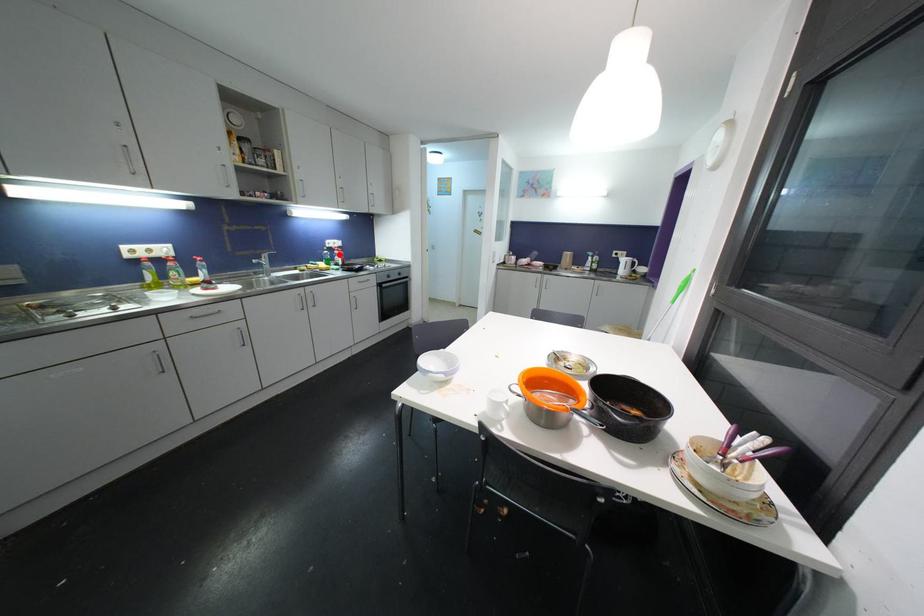
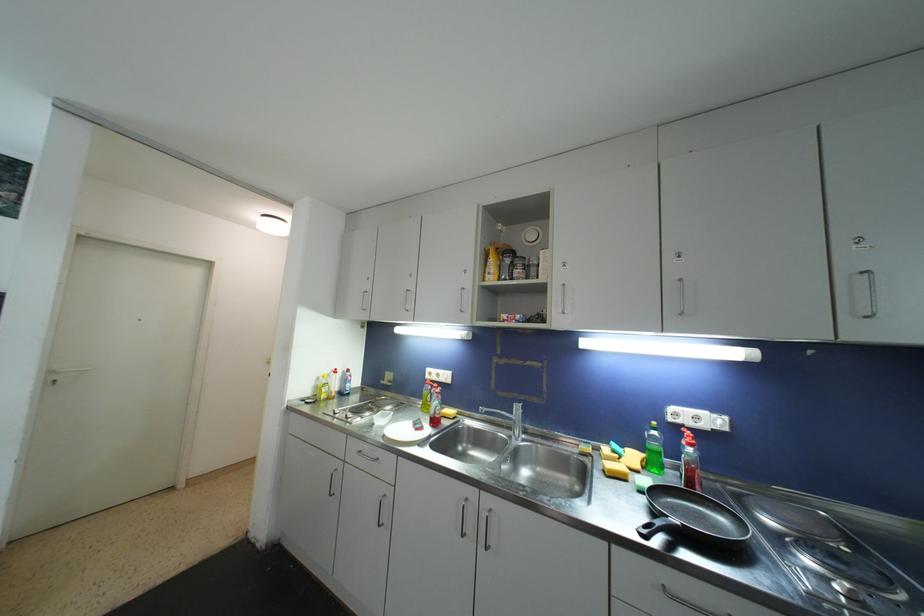
The point at the highlighted location is marked in the first image. Where is the corresponding point in the second image?

(687, 445)